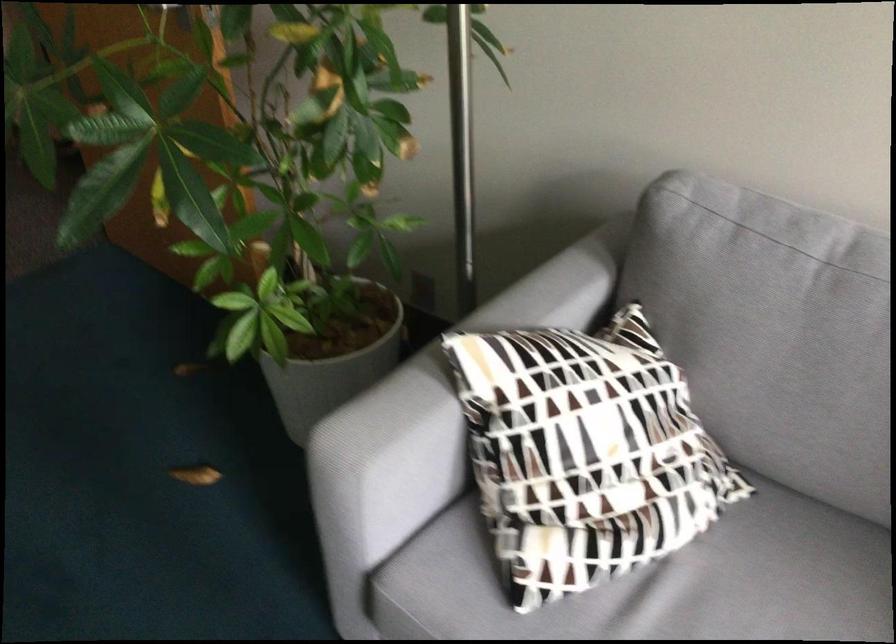
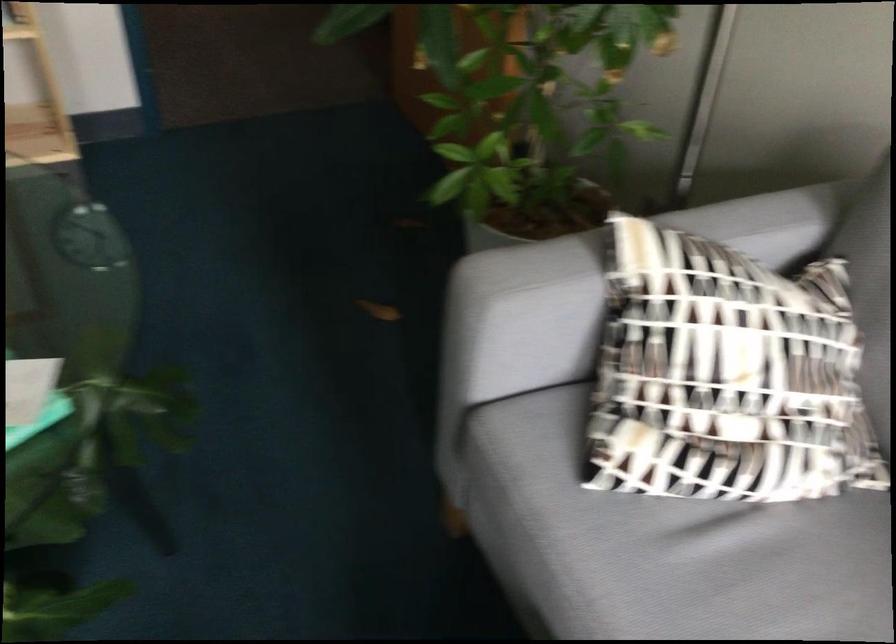
Question: In a continuous first-person perspective shot, in which direction is the camera moving?

Choices:
 (A) Left
 (B) Right
 (C) Forward
 (D) Backward

Answer: (B)